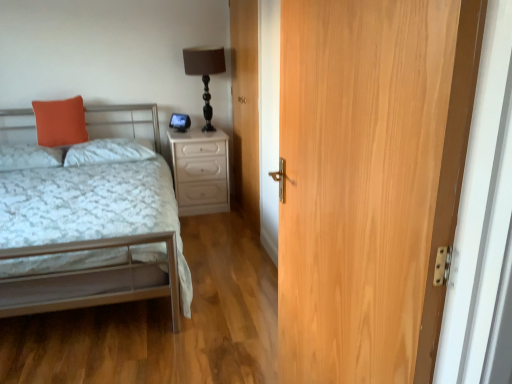
Question: From a real-world perspective, is light brown wood door at center, positioned as the first door in back-to-front order, physically located above or below light brown wood door at right, which is the 1th door from right to left?

Choices:
 (A) below
 (B) above

Answer: (B)

Question: Is light brown wood door at center, which is the 1th door in left-to-right order, to the left or to the right of light brown wood door at right, which is the 1th door from right to left, in the image?

Choices:
 (A) left
 (B) right

Answer: (A)

Question: Which of these objects is positioned closest to the matte black table lamp at upper center?

Choices:
 (A) light brown wood door at right, which is the 1th door from right to left
 (B) white glossy nightstand at center
 (C) orange fabric pillow at left, marked as the first pillow in a right-to-left arrangement
 (D) metallic silver bed at left
 (E) orange matte pillow at upper left, marked as the second pillow in a left-to-right arrangement

Answer: (B)

Question: Which object is positioned closest to the metallic silver bed at left?

Choices:
 (A) orange fabric pillow at left, placed as the 1th pillow when sorted from left to right
 (B) light brown wood door at center, the 2th door from the front
 (C) orange matte pillow at upper left, arranged as the 2th pillow when viewed from the right
 (D) matte black table lamp at upper center
 (E) light brown wood door at right, the second door from the left

Answer: (A)